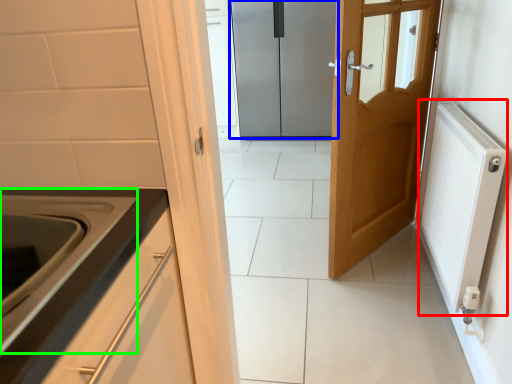
Question: Which object is positioned closest to radiator (highlighted by a red box)? Select from door (highlighted by a blue box) and oven (highlighted by a green box).

Choices:
 (A) door
 (B) oven

Answer: (B)